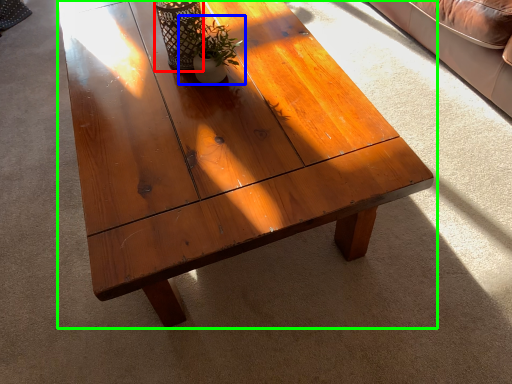
Question: Considering the real-world distances, which object is closest to glass vase (highlighted by a red box)? houseplant (highlighted by a blue box) or coffee table (highlighted by a green box).

Choices:
 (A) houseplant
 (B) coffee table

Answer: (A)